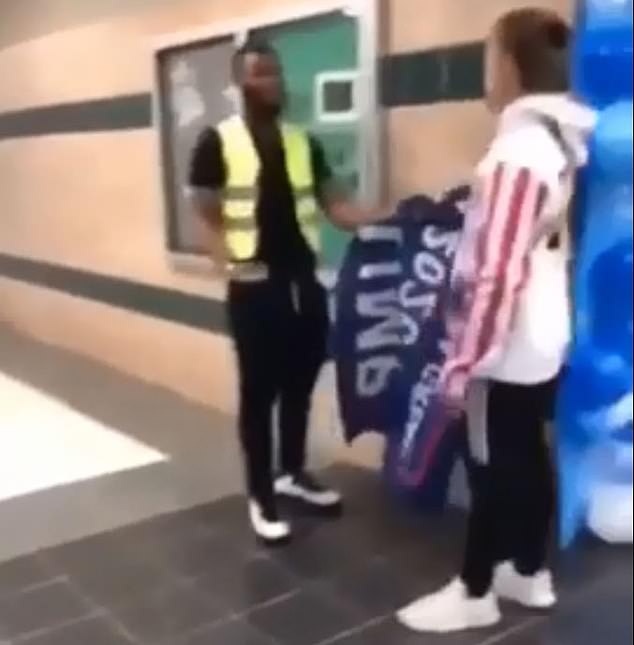
At what (x,y) coordinates should I click in order to perform the action: click on black tile floor. Please return your answer as a coordinate pair (x, y). This screenshot has width=634, height=645. Looking at the image, I should click on [x=257, y=587].